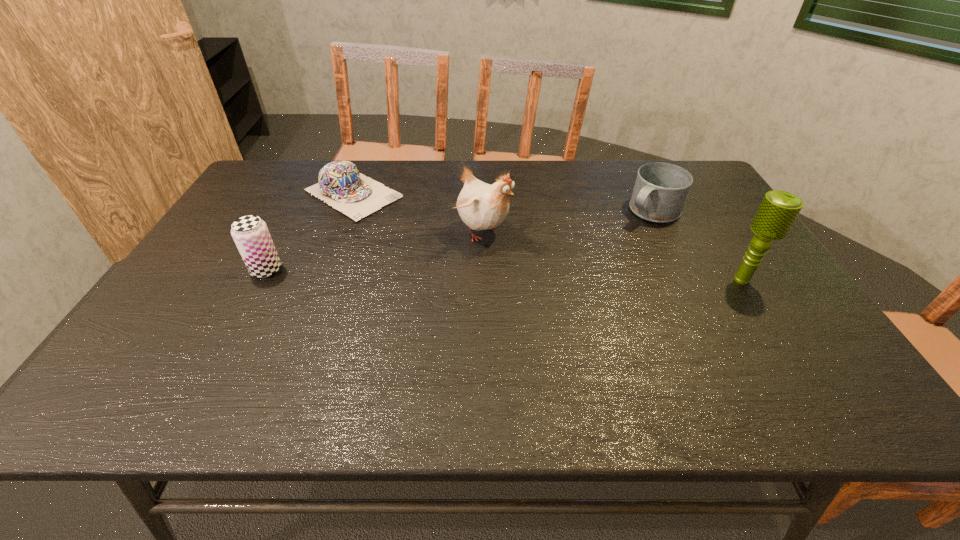
Where is `beer can`? This screenshot has height=540, width=960. beer can is located at coordinates (250, 233).

I want to click on the rightmost object, so click(x=779, y=209).

Where is `the second object from right to left`? Image resolution: width=960 pixels, height=540 pixels. the second object from right to left is located at coordinates click(x=660, y=191).

Find the location of a particular element. The height and width of the screenshot is (540, 960). mug is located at coordinates (660, 191).

What are the coordinates of `the shortest object` in the screenshot? It's located at (341, 185).

Identify the location of bird. The height and width of the screenshot is (540, 960). (481, 206).

You are a GUI agent. You are given a task and a screenshot of the screen. Output one action in this format:
    pyautogui.click(x=<x>, y=<y>)
    Task: Click on the vacant area situated on the front of the third shortest object
    
    Given the screenshot: What is the action you would take?
    pyautogui.click(x=228, y=342)

Locate an element on the screen. free space located on the left of the rightmost object is located at coordinates (648, 280).

Locate an element on the screen. free location located 0.160m on the side of the mug with the handle is located at coordinates (607, 248).

Where is `vacant space located 0.390m on the side of the mug with the handle`? Image resolution: width=960 pixels, height=540 pixels. vacant space located 0.390m on the side of the mug with the handle is located at coordinates (556, 290).